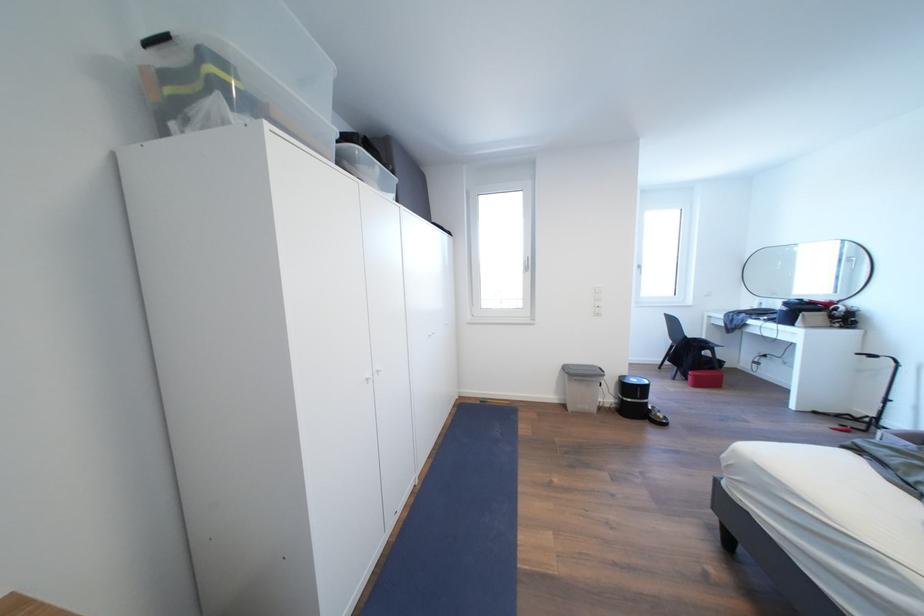
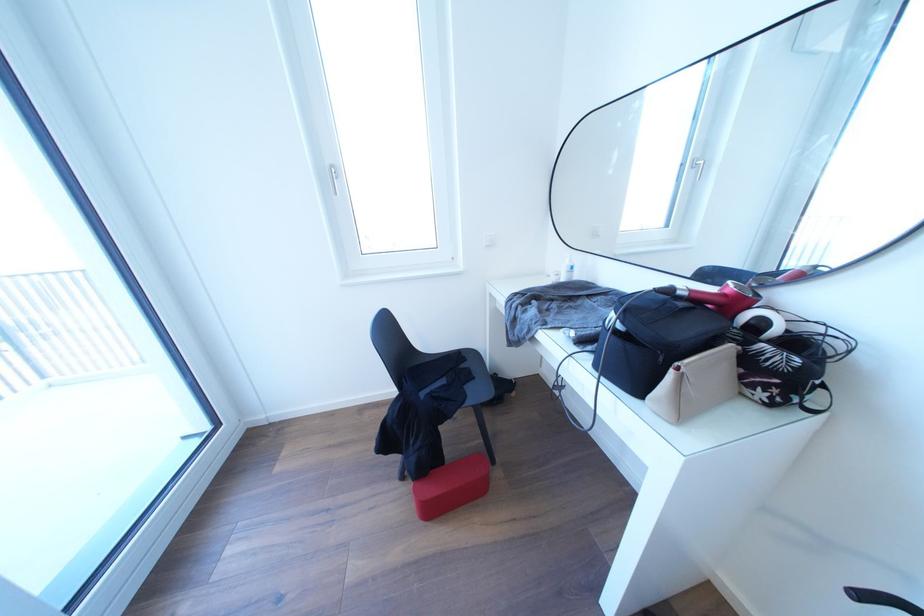
The point at (808, 305) is marked in the first image. Where is the corresponding point in the second image?

(675, 296)